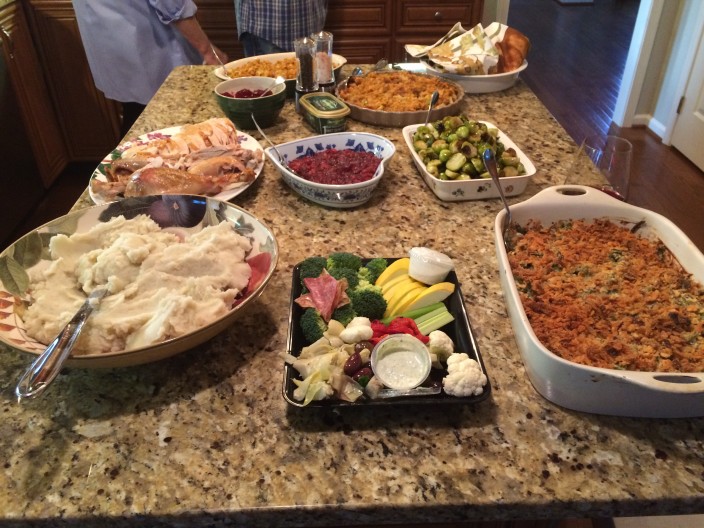
You are a GUI agent. You are given a task and a screenshot of the screen. Output one action in this format:
    pyautogui.click(x=<x>, y=<y>)
    Task: Click on the casserole dish
    The height and width of the screenshot is (528, 704).
    Given the screenshot: What is the action you would take?
    pyautogui.click(x=593, y=386)